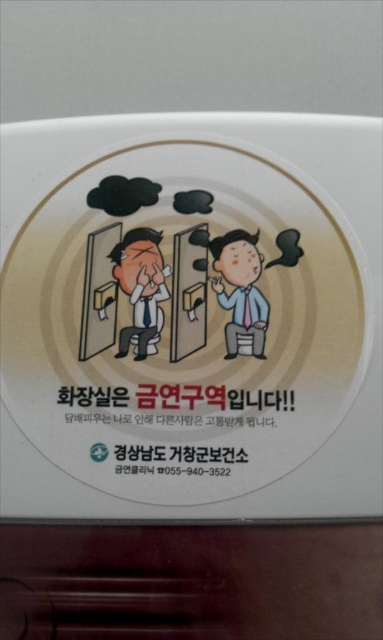
Can you confirm if black paper text at center is positioned to the right of matte black man at center?

No, black paper text at center is not to the right of matte black man at center.

Identify the location of black paper text at center. This screenshot has width=383, height=640. (175, 404).

Who is positioned more to the right, white glossy plate at center or matte black man at left?

white glossy plate at center is more to the right.

Who is shorter, white glossy plate at center or matte black man at left?

With less height is matte black man at left.

Is point (343, 211) closer to viewer compared to point (148, 342)?

No, (343, 211) is further to viewer.

Locate an element on the screen. white glossy plate at center is located at coordinates (191, 317).

Does white glossy plate at center have a greater height compared to matte black man at center?

Yes.

Between white glossy plate at center and matte black man at center, which one is positioned higher?

Positioned higher is matte black man at center.

This screenshot has width=383, height=640. What do you see at coordinates (191, 317) in the screenshot?
I see `white glossy plate at center` at bounding box center [191, 317].

I want to click on white glossy plate at center, so click(x=191, y=317).